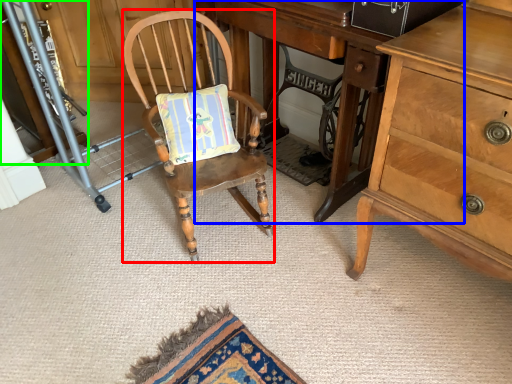
Question: Considering the real-world distances, which object is closest to chair (highlighted by a red box)? desk (highlighted by a blue box) or cabinetry (highlighted by a green box).

Choices:
 (A) desk
 (B) cabinetry

Answer: (A)